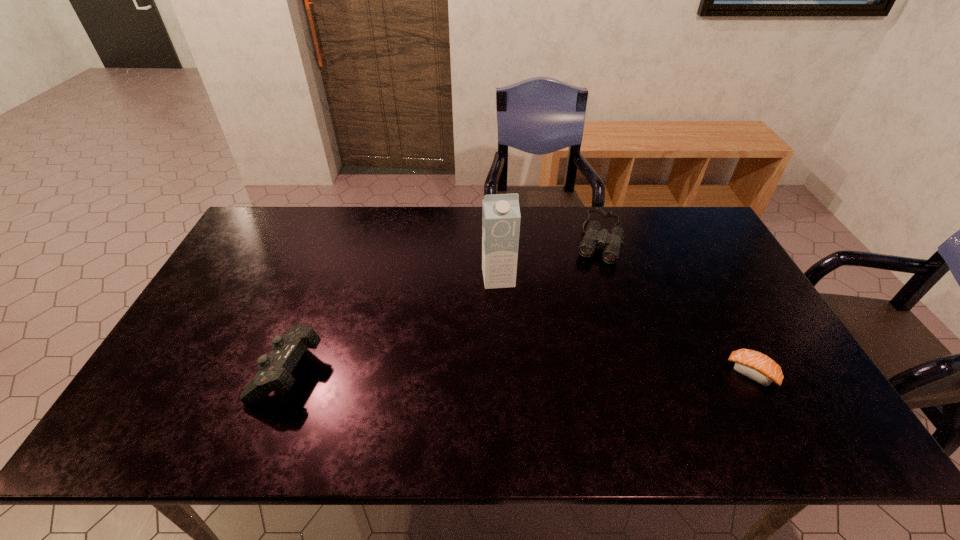
Image resolution: width=960 pixels, height=540 pixels. I want to click on free point located on the front label of the third object from right to left, so click(516, 376).

You are a GUI agent. You are given a task and a screenshot of the screen. Output one action in this format:
    pyautogui.click(x=<x>, y=<y>)
    Task: Click on the vacant space located 0.090m on the front label of the third object from right to left
    
    Given the screenshot: What is the action you would take?
    pyautogui.click(x=504, y=312)

What are the coordinates of `vacant region located on the front label of the third object from right to left` in the screenshot? It's located at (516, 373).

Identify the location of vacant space positioned 0.320m at the eyepiece of the second object from right to left. Image resolution: width=960 pixels, height=540 pixels. (574, 337).

This screenshot has height=540, width=960. Find the location of `free space located at the eyepiece of the second object from right to left`. free space located at the eyepiece of the second object from right to left is located at coordinates (574, 334).

Where is `free space located at the eyepiece of the second object from right to left`? The height and width of the screenshot is (540, 960). free space located at the eyepiece of the second object from right to left is located at coordinates (x=593, y=276).

Image resolution: width=960 pixels, height=540 pixels. In order to click on object located in the far edge section of the desktop in this screenshot , I will do `click(593, 236)`.

I want to click on control that is at the near edge, so click(275, 369).

Where is `sushi at the near edge`? sushi at the near edge is located at coordinates (752, 364).

The height and width of the screenshot is (540, 960). What are the coordinates of `object positioned at the right edge` in the screenshot? It's located at (752, 364).